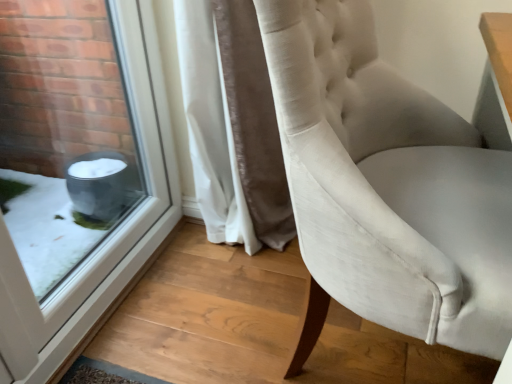
Measure the distance between satin white chair at center and camera.

The depth of satin white chair at center is 22.94 inches.

The width and height of the screenshot is (512, 384). What are the coordinates of `white velvet curtain at center` in the screenshot? It's located at (232, 125).

Considering the sizes of objects satin white chair at center and white velvet curtain at center in the image provided, who is thinner, satin white chair at center or white velvet curtain at center?

white velvet curtain at center.

Consider the image. From the image's perspective, between satin white chair at center and white velvet curtain at center, who is located below?

From the image's view, satin white chair at center is below.

How distant is satin white chair at center from white velvet curtain at center?

satin white chair at center and white velvet curtain at center are 18.94 inches apart.

At what (x,y) coordinates should I click in order to perform the action: click on chair below the white velvet curtain at center (from the image's perspective). Please return your answer as a coordinate pair (x, y). Looking at the image, I should click on (386, 187).

Is white velvet curtain at center positioned beyond the bounds of transparent glass window at lower left?

Yes, white velvet curtain at center is located beyond the bounds of transparent glass window at lower left.

From a real-world perspective, who is located higher, white velvet curtain at center or transparent glass window at lower left?

transparent glass window at lower left, from a real-world perspective.

Which of these two, white velvet curtain at center or transparent glass window at lower left, is smaller?

With smaller size is transparent glass window at lower left.

How different are the orientations of white velvet curtain at center and transparent glass window at lower left in degrees?

They differ by 0.982 degrees in their facing directions.

Is transparent glass window at lower left located within satin white chair at center?

No, satin white chair at center does not contain transparent glass window at lower left.

Considering the relative sizes of satin white chair at center and transparent glass window at lower left in the image provided, is satin white chair at center wider than transparent glass window at lower left?

Yes.

Measure the distance between satin white chair at center and transparent glass window at lower left.

satin white chair at center is 34.53 inches away from transparent glass window at lower left.

Is satin white chair at center oriented towards transparent glass window at lower left?

No, satin white chair at center is not oriented towards transparent glass window at lower left.

Who is bigger, transparent glass window at lower left or satin white chair at center?

satin white chair at center.

Measure the distance from transparent glass window at lower left to satin white chair at center.

transparent glass window at lower left is 34.53 inches from satin white chair at center.

Find the location of a particular element. This screenshot has height=384, width=512. chair that appears in front of the transparent glass window at lower left is located at coordinates (386, 187).

In the scene shown: From the image's perspective, which one is positioned lower, transparent glass window at lower left or satin white chair at center?

satin white chair at center is shown below in the image.

How much distance is there between white velvet curtain at center and satin white chair at center?

They are 18.94 inches apart.

Which object is thinner, white velvet curtain at center or satin white chair at center?

white velvet curtain at center.

Considering the positions of objects white velvet curtain at center and satin white chair at center in the image provided, who is more to the left, white velvet curtain at center or satin white chair at center?

white velvet curtain at center.

How many degrees apart are the facing directions of white velvet curtain at center and satin white chair at center?

white velvet curtain at center and satin white chair at center are facing 1.5 degrees away from each other.

Are transparent glass window at lower left and white velvet curtain at center beside each other?

transparent glass window at lower left and white velvet curtain at center are clearly separated.

Is transparent glass window at lower left positioned with its back to white velvet curtain at center?

No, transparent glass window at lower left is not facing the opposite direction of white velvet curtain at center.

Is point (35, 15) more distant than point (240, 100)?

Yes, point (35, 15) is farther from viewer.

Is transparent glass window at lower left inside or outside of white velvet curtain at center?

transparent glass window at lower left lies outside white velvet curtain at center.

Locate an element on the screen. curtain above the satin white chair at center (from the image's perspective) is located at coordinates (232, 125).

I want to click on window in front of the white velvet curtain at center, so click(74, 177).

Estimate the real-world distances between objects in this image. Which object is closer to white velvet curtain at center, transparent glass window at lower left or satin white chair at center?

transparent glass window at lower left is closer to white velvet curtain at center.

Based on their spatial positions, is satin white chair at center or transparent glass window at lower left closer to white velvet curtain at center?

transparent glass window at lower left is closer to white velvet curtain at center.

Based on the photo, based on their spatial positions, is white velvet curtain at center or transparent glass window at lower left further from satin white chair at center?

transparent glass window at lower left is further to satin white chair at center.

Which object lies nearer to the anchor point transparent glass window at lower left, satin white chair at center or white velvet curtain at center?

Among the two, white velvet curtain at center is located nearer to transparent glass window at lower left.

Which object lies further to the anchor point transparent glass window at lower left, white velvet curtain at center or satin white chair at center?

satin white chair at center lies further to transparent glass window at lower left than the other object.

Based on their spatial positions, is transparent glass window at lower left or white velvet curtain at center further from satin white chair at center?

transparent glass window at lower left.

Locate an element on the screen. The image size is (512, 384). curtain between transparent glass window at lower left and satin white chair at center is located at coordinates (232, 125).